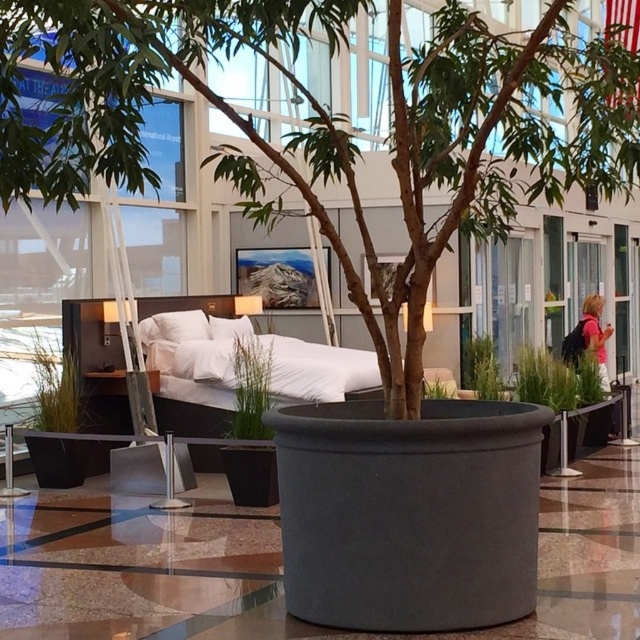
You are a guest in this hotel lobby and want to take a photo of the white fabric bed at center without the brown matte tree at center blocking the view. Is it possible to position yourself in a way that the bed is visible without the tree in front?

The brown matte tree at center is in front of the white fabric bed at center, so you cannot position yourself to see the bed without the tree blocking it.

You are a guest in this hotel lobby and want to place a rectangular luggage box that is 1.2 meters wide on the floor. The box must be placed between the white fabric bed at center and the white soft pillow at center. Can the box fit in that space?

The white fabric bed at center might be wider than the white soft pillow at center, so the space between them may be sufficient to accommodate the 1.2 meters wide luggage box. However, since the exact width difference isn